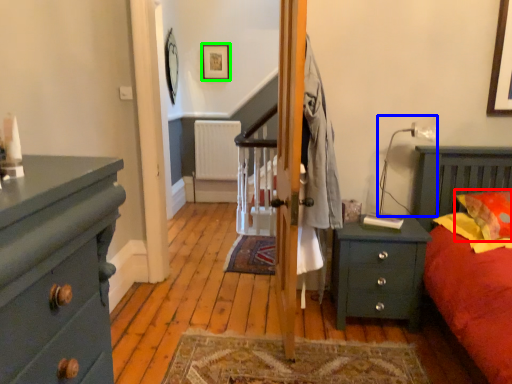
Question: Which is farther away from pillow (highlighted by a red box)? lamp (highlighted by a blue box) or picture frame (highlighted by a green box)?

Choices:
 (A) lamp
 (B) picture frame

Answer: (B)